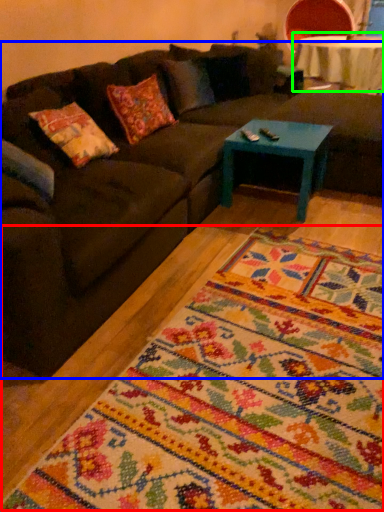
Question: Which is farther away from mat (highlighted by a red box)? studio couch (highlighted by a blue box) or table (highlighted by a green box)?

Choices:
 (A) studio couch
 (B) table

Answer: (B)